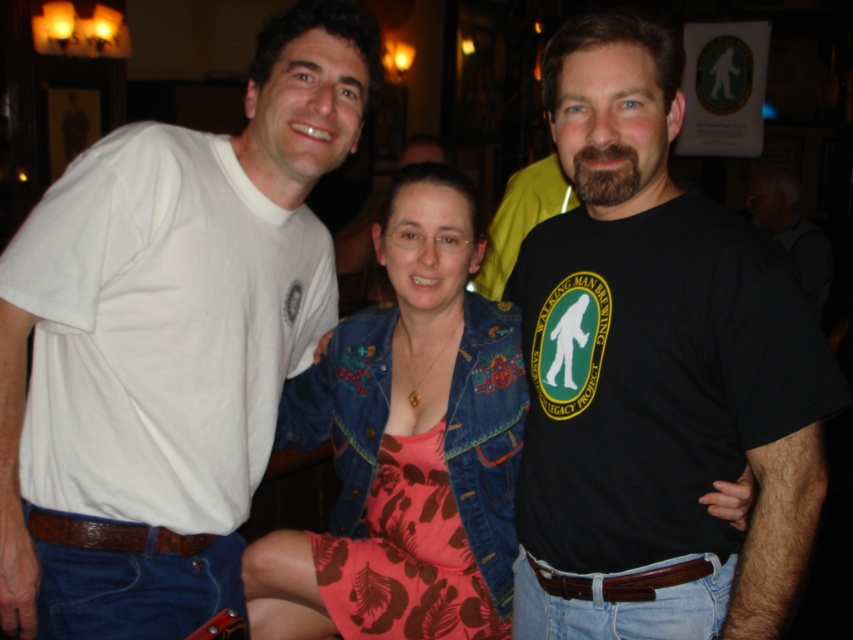
Who is taller, denim jacket at center or brown leather belt at lower center?

denim jacket at center is taller.

Which is in front, point (431, 493) or point (575, 582)?

Point (575, 582)

What do you see at coordinates (405, 445) in the screenshot? This screenshot has height=640, width=853. I see `denim jacket at center` at bounding box center [405, 445].

Where is `denim jacket at center`? This screenshot has width=853, height=640. denim jacket at center is located at coordinates (405, 445).

Is white t-shirt at left positioned in front of brown leather belt at lower center?

Yes, it is.

Which is behind, point (258, 54) or point (676, 582)?

The point (258, 54) is more distant.

In order to click on white t-shirt at left in this screenshot , I will do `click(169, 336)`.

Is black cotton t-shirt at center further to the viewer compared to brown leather belt at lower left?

That is False.

Is point (556, 317) positioned before point (119, 525)?

No, it is not.

Identify the location of black cotton t-shirt at center. (654, 374).